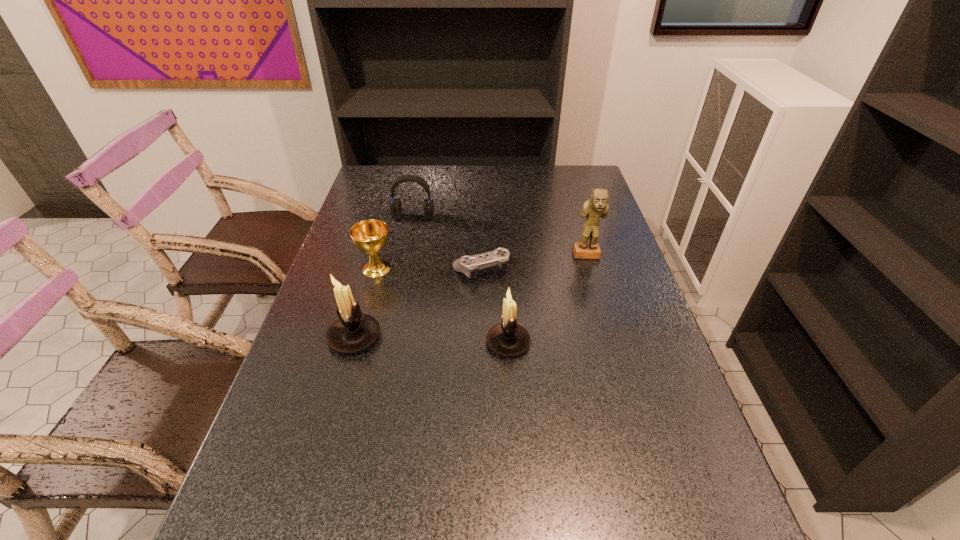
Locate an element on the screen. vacant space located 0.210m on the left of the control is located at coordinates (382, 269).

Image resolution: width=960 pixels, height=540 pixels. Find the location of `free region located 0.400m on the front of the chalice`. free region located 0.400m on the front of the chalice is located at coordinates (340, 400).

Locate an element on the screen. The height and width of the screenshot is (540, 960). candle holder situated at the left edge is located at coordinates (354, 331).

Locate an element on the screen. The height and width of the screenshot is (540, 960). headset located in the left edge section of the desktop is located at coordinates (395, 206).

This screenshot has width=960, height=540. Find the location of `chalice that is positioned at the left edge`. chalice that is positioned at the left edge is located at coordinates (370, 236).

The height and width of the screenshot is (540, 960). Identify the location of object that is at the right edge. (596, 207).

Where is `free space at the far edge`? The width and height of the screenshot is (960, 540). free space at the far edge is located at coordinates (426, 175).

The width and height of the screenshot is (960, 540). What are the coordinates of `free space at the near edge` in the screenshot? It's located at (526, 470).

The image size is (960, 540). In the image, there is a desktop. Identify the location of free region at the left edge. (329, 350).

Where is `free space at the right edge of the desktop`? The width and height of the screenshot is (960, 540). free space at the right edge of the desktop is located at coordinates (616, 364).